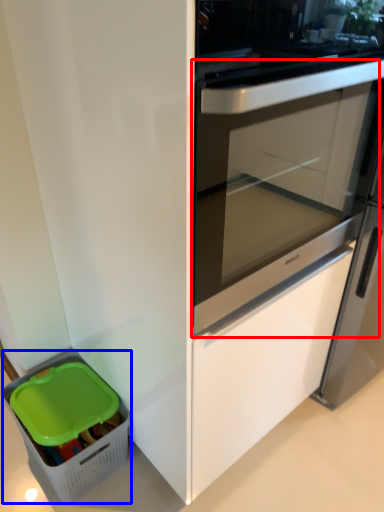
Question: Among these objects, which one is nearest to the camera, screen door (highlighted by a red box) or storage box (highlighted by a blue box)?

Choices:
 (A) screen door
 (B) storage box

Answer: (A)